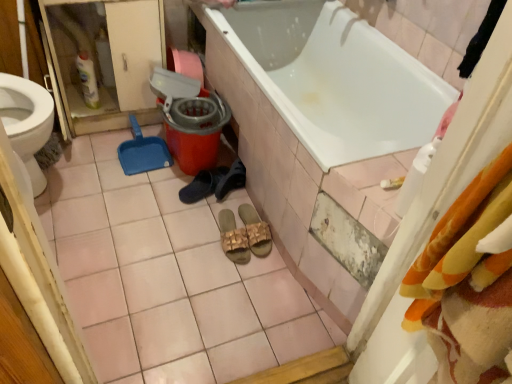
Question: Is black rubber slipper at center, acting as the 3th footwear starting from the right, smaller than orange plastic mop bucket at center?

Choices:
 (A) yes
 (B) no

Answer: (A)

Question: Are black rubber slipper at center, which appears as the first footwear when viewed from the left, and orange plastic mop bucket at center far apart?

Choices:
 (A) yes
 (B) no

Answer: (B)

Question: Is black rubber slipper at center, which appears as the first footwear when viewed from the left, outside of orange plastic mop bucket at center?

Choices:
 (A) yes
 (B) no

Answer: (A)

Question: From a real-world perspective, is black rubber slipper at center, acting as the 3th footwear starting from the right, beneath orange plastic mop bucket at center?

Choices:
 (A) yes
 (B) no

Answer: (A)

Question: From the image's perspective, is black rubber slipper at center, acting as the 3th footwear starting from the right, located above orange plastic mop bucket at center?

Choices:
 (A) no
 (B) yes

Answer: (A)

Question: Is black rubber slipper at center, which appears as the first footwear when viewed from the left, turned away from orange plastic mop bucket at center?

Choices:
 (A) no
 (B) yes

Answer: (A)

Question: Can you confirm if black suede shoes at center, positioned as the second footwear in right-to-left order, is smaller than orange plastic mop bucket at center?

Choices:
 (A) yes
 (B) no

Answer: (A)

Question: Can you confirm if black suede shoes at center, which ranks as the second footwear in left-to-right order, is wider than orange plastic mop bucket at center?

Choices:
 (A) yes
 (B) no

Answer: (B)

Question: Is black suede shoes at center, positioned as the second footwear in right-to-left order, closer to camera compared to orange plastic mop bucket at center?

Choices:
 (A) yes
 (B) no

Answer: (B)

Question: From the image's perspective, is black suede shoes at center, positioned as the second footwear in right-to-left order, above orange plastic mop bucket at center?

Choices:
 (A) yes
 (B) no

Answer: (B)

Question: From the image's perspective, would you say black suede shoes at center, which ranks as the second footwear in left-to-right order, is shown under orange plastic mop bucket at center?

Choices:
 (A) no
 (B) yes

Answer: (B)

Question: Does black suede shoes at center, which ranks as the second footwear in left-to-right order, have a larger size compared to orange plastic mop bucket at center?

Choices:
 (A) no
 (B) yes

Answer: (A)

Question: Is black rubber slipper at center, which appears as the first footwear when viewed from the left, not close to beige woven sandals at center, acting as the 3th footwear starting from the left?

Choices:
 (A) no
 (B) yes

Answer: (A)